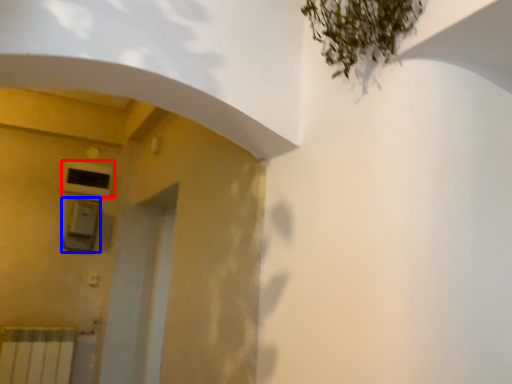
Question: Among these objects, which one is nearest to the camera, air conditioning (highlighted by a red box) or lift (highlighted by a blue box)?

Choices:
 (A) air conditioning
 (B) lift

Answer: (B)